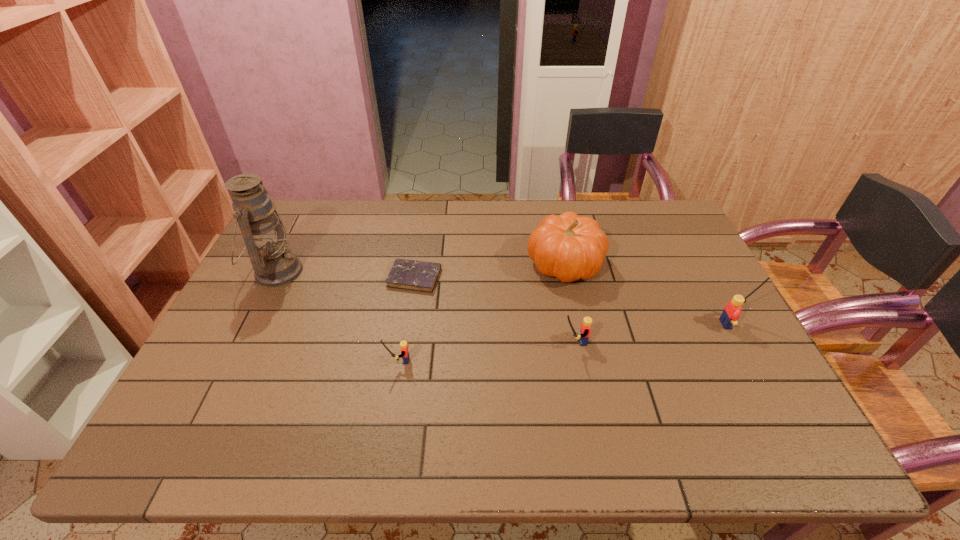
At what (x,y) coordinates should I click in order to perform the action: click on object that is at the left edge. Please return your answer as a coordinate pair (x, y). Image resolution: width=960 pixels, height=540 pixels. Looking at the image, I should click on (274, 264).

The height and width of the screenshot is (540, 960). I want to click on object at the right edge, so click(732, 310).

At what (x,y) coordinates should I click in order to perform the action: click on vacant space at the far edge of the desktop. Please return your answer as a coordinate pair (x, y). The image size is (960, 540). Looking at the image, I should click on (343, 241).

Identify the location of free region at the near edge of the desktop. (518, 394).

In the image, there is a desktop. Where is `vacant space at the left edge`? Image resolution: width=960 pixels, height=540 pixels. vacant space at the left edge is located at coordinates (299, 285).

This screenshot has width=960, height=540. I want to click on free point at the right edge, so click(719, 341).

What are the coordinates of `free spot at the far left corner of the desktop` in the screenshot? It's located at (312, 205).

I want to click on vacant space at the far right corner of the desktop, so click(655, 236).

Locate an element on the screen. The height and width of the screenshot is (540, 960). blank region between the tallest object and the shortest object is located at coordinates (346, 274).

Identify the location of vacant space that is in between the leftmost Lego and the second tallest Lego. (486, 351).